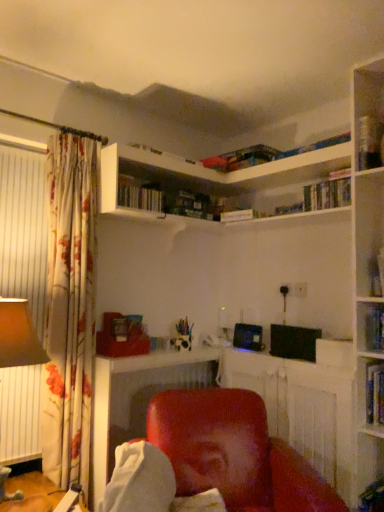
Question: From a real-world perspective, is hardcover book at upper right, which is the 1th book in bottom-to-top order, above or below hardcover book at upper right, the second book in the right-to-left sequence?

Choices:
 (A) below
 (B) above

Answer: (A)

Question: In terms of size, does hardcover book at upper right, the 1th book from the right, appear bigger or smaller than hardcover book at upper right, which ranks as the fourth book in bottom-to-top order?

Choices:
 (A) small
 (B) big

Answer: (A)

Question: Which of these objects is positioned closest to the hardcover book at upper right, the fourth book when ordered from top to bottom?

Choices:
 (A) matte red chair at lower center
 (B) hardcover book at upper center, the 4th book viewed from the right
 (C) matte brown lampshade at left
 (D) hardcover book at upper right, the third book from the left
 (E) hardcover book at upper right, the second book positioned from the left

Answer: (E)

Question: Which object is the closest to the matte red chair at center?

Choices:
 (A) hardcover book at upper right, positioned as the 3th book in bottom-to-top order
 (B) hardcover book at upper right, the 4th book in the left-to-right sequence
 (C) matte red chair at lower center
 (D) hardcover book at upper center, the 4th book viewed from the right
 (E) matte brown lampshade at left

Answer: (C)